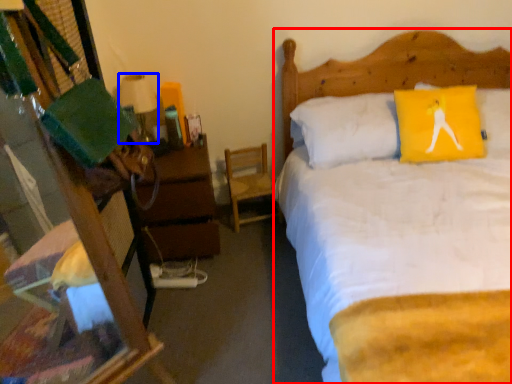
Question: Which object is further to the camera taking this photo, bed (highlighted by a red box) or lamp (highlighted by a blue box)?

Choices:
 (A) bed
 (B) lamp

Answer: (B)